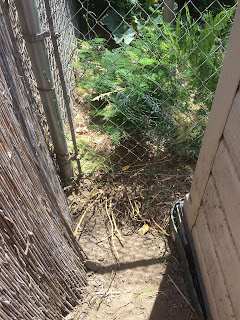
This screenshot has height=320, width=240. Identify the location of wall. (221, 178).